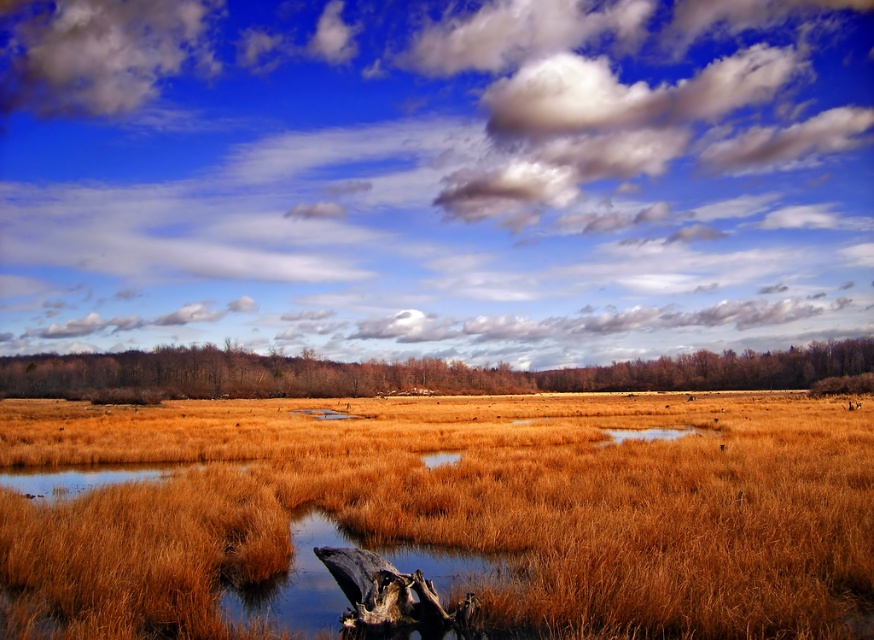
How much distance is there between brown matte tree at center and dark brown wood at lower center?

They are 73.05 meters apart.

From the picture: Who is shorter, brown matte tree at center or dark brown wood at lower center?

With less height is dark brown wood at lower center.

Is point (373, 385) positioned after point (394, 593)?

That is True.

Where is `brown matte tree at center`? The height and width of the screenshot is (640, 874). brown matte tree at center is located at coordinates (406, 372).

Who is positioned more to the right, white fluffy cloud at upper center or dry grass at center?

dry grass at center is more to the right.

Which is above, white fluffy cloud at upper center or dry grass at center?

white fluffy cloud at upper center

Which is behind, point (16, 285) or point (205, 488)?

The point (16, 285) is behind.

You are a GUI agent. You are given a task and a screenshot of the screen. Output one action in this format:
    pyautogui.click(x=<x>, y=<y>)
    Task: Click on the white fluffy cloud at upper center
    The height and width of the screenshot is (640, 874).
    Given the screenshot: What is the action you would take?
    pyautogui.click(x=435, y=176)

Can you confirm if white fluffy cloud at upper center is positioned above brown matte tree at center?

Correct, white fluffy cloud at upper center is located above brown matte tree at center.

Between white fluffy cloud at upper center and brown matte tree at center, which one appears on the right side from the viewer's perspective?

Positioned to the right is brown matte tree at center.

This screenshot has height=640, width=874. Identify the location of white fluffy cloud at upper center. (435, 176).

Locate an element on the screen. This screenshot has height=640, width=874. white fluffy cloud at upper center is located at coordinates (435, 176).